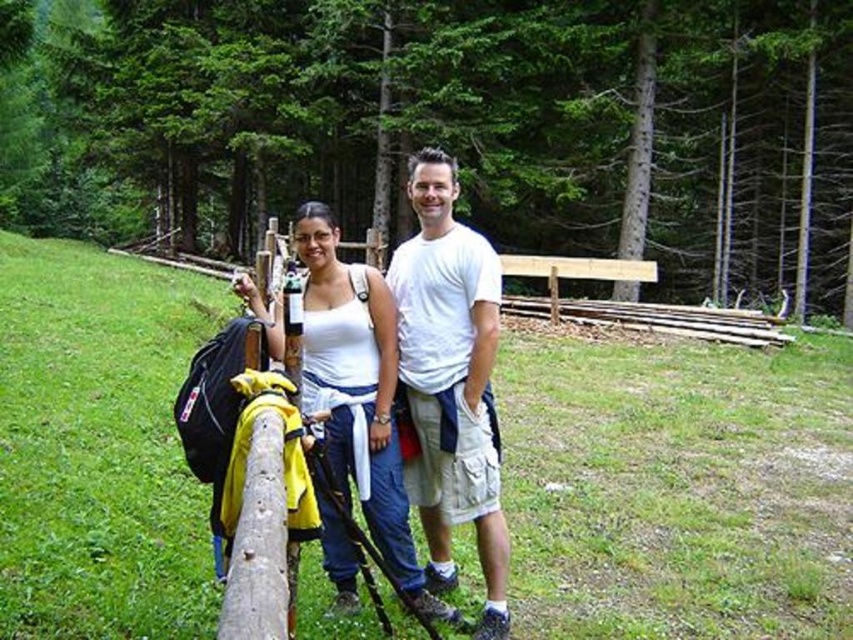
Question: Among these points, which one is farthest from the camera?

Choices:
 (A) (363, 355)
 (B) (413, 316)

Answer: (B)

Question: Can you confirm if white cotton t-shirt at center is smaller than white cotton tank top at center?

Choices:
 (A) yes
 (B) no

Answer: (A)

Question: Is white cotton t-shirt at center below white cotton tank top at center?

Choices:
 (A) yes
 (B) no

Answer: (B)

Question: Which point is closer to the camera?

Choices:
 (A) (450, 220)
 (B) (323, 541)

Answer: (A)

Question: Can you confirm if white cotton t-shirt at center is thinner than white cotton tank top at center?

Choices:
 (A) no
 (B) yes

Answer: (B)

Question: Which point is closer to the camera?

Choices:
 (A) (468, 289)
 (B) (326, 502)

Answer: (B)